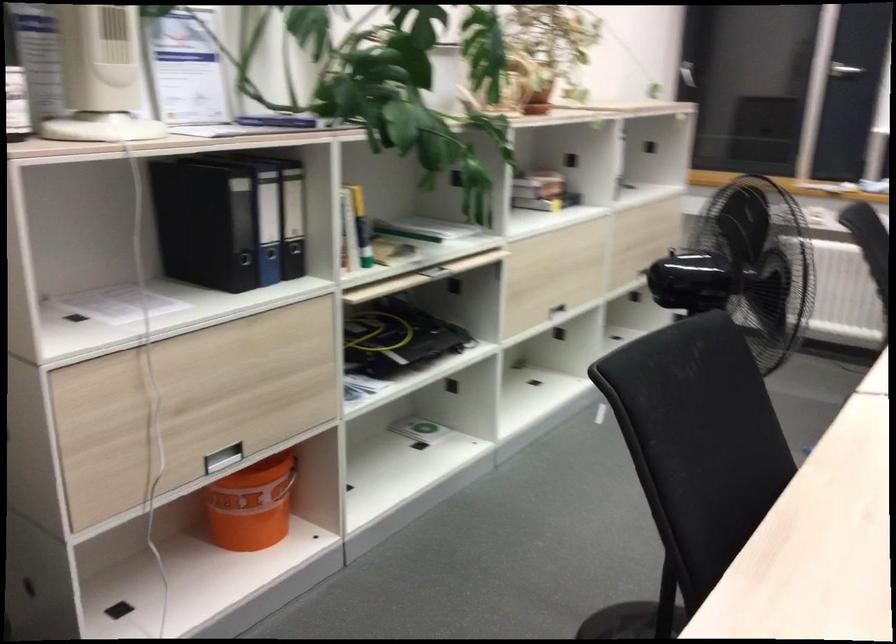
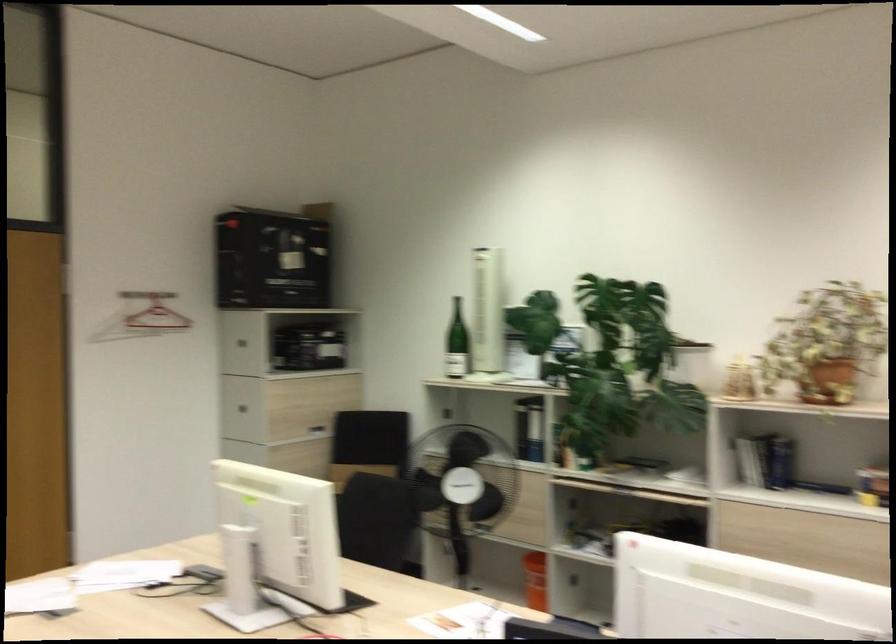
The point at (x=298, y=504) is marked in the first image. Where is the corresponding point in the second image?

(535, 580)